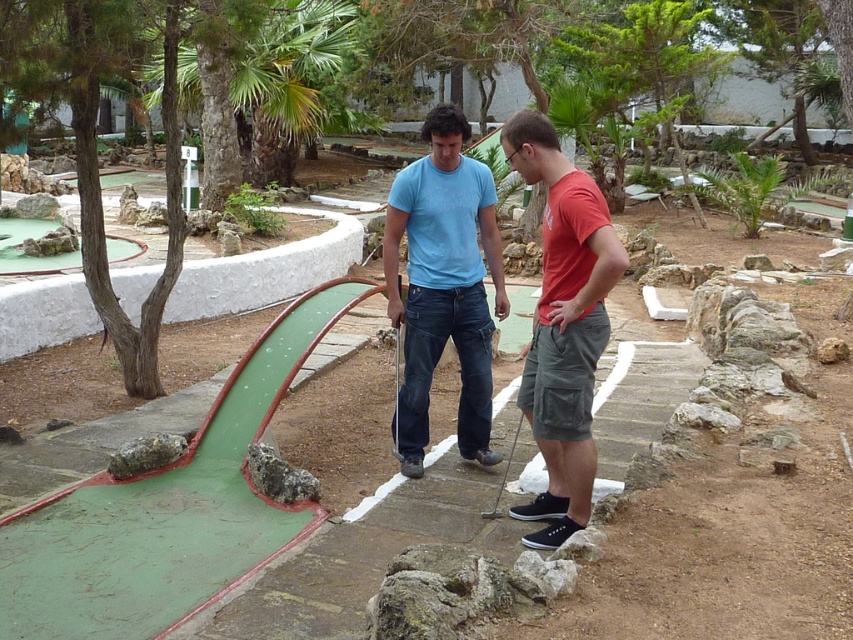
Question: Which point is closer to the camera?

Choices:
 (A) matte red t-shirt at center
 (B) matte blue jeans at center

Answer: (A)

Question: Which of the following is the closest to the observer?

Choices:
 (A) 445,134
 (B) 561,486

Answer: (B)

Question: Can you confirm if matte blue jeans at center is positioned to the right of matte red t-shirt at center?

Choices:
 (A) yes
 (B) no

Answer: (B)

Question: From the image, what is the correct spatial relationship of matte blue jeans at center in relation to matte red t-shirt at center?

Choices:
 (A) below
 (B) above

Answer: (B)

Question: Can you confirm if matte blue jeans at center is smaller than matte red t-shirt at center?

Choices:
 (A) yes
 (B) no

Answer: (A)

Question: Which point is closer to the camera taking this photo?

Choices:
 (A) (x=503, y=147)
 (B) (x=410, y=220)

Answer: (A)